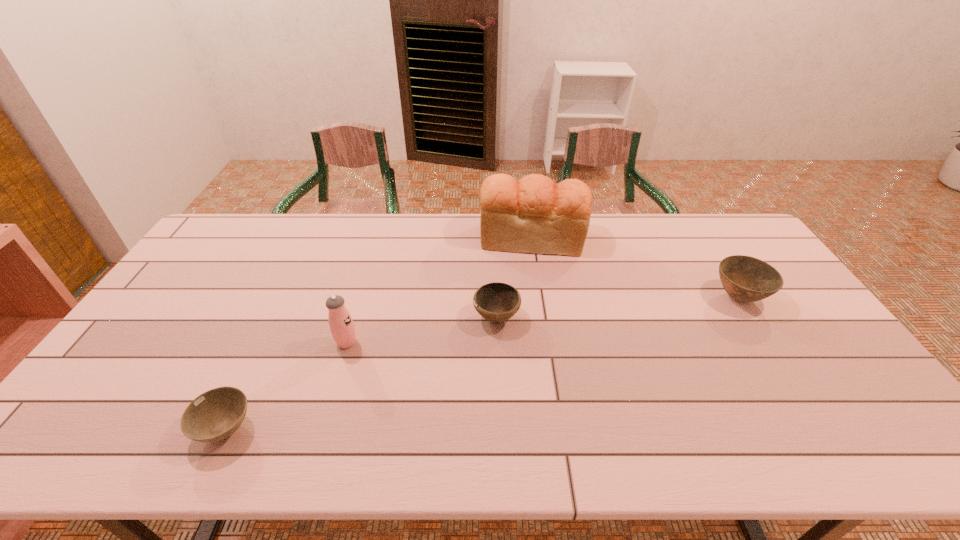
I want to click on the farthest object, so tap(534, 215).

Where is `the tallest object`? This screenshot has height=540, width=960. the tallest object is located at coordinates (534, 215).

In order to click on thermos bottle in this screenshot , I will do `click(341, 325)`.

Locate an element on the screen. The width and height of the screenshot is (960, 540). the second object from left to right is located at coordinates point(341,325).

Where is `the rightmost bowl`? the rightmost bowl is located at coordinates (746, 279).

At what (x,y) coordinates should I click in order to perform the action: click on the third tallest object. Please return your answer as a coordinate pair (x, y). This screenshot has height=540, width=960. Looking at the image, I should click on (746, 279).

Where is `the second bowl from left to right`? The image size is (960, 540). the second bowl from left to right is located at coordinates (497, 302).

Where is `the leftmost bowl`? The height and width of the screenshot is (540, 960). the leftmost bowl is located at coordinates (216, 414).

Find the location of a particular element. Image resolution: width=960 pixels, height=540 pixels. the nearest object is located at coordinates (216, 414).

The image size is (960, 540). Find the location of `free point located 0.110m on the right of the tallest object`. free point located 0.110m on the right of the tallest object is located at coordinates (614, 238).